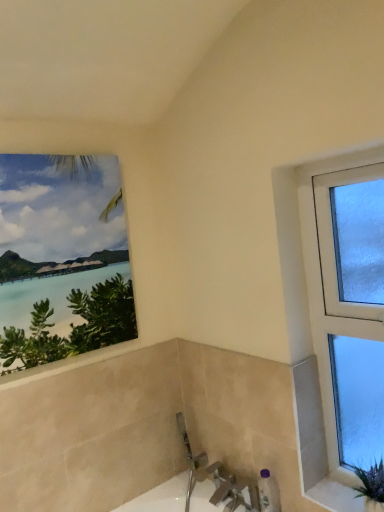
Question: In terms of height, does white textured stone at lower right look taller or shorter compared to purple plastic bottle at lower right?

Choices:
 (A) tall
 (B) short

Answer: (B)

Question: In the image, is white textured stone at lower right on the left side or the right side of purple plastic bottle at lower right?

Choices:
 (A) left
 (B) right

Answer: (B)

Question: Which object is the closest to the matte canvas painting at upper left, which appears as the 2th window when viewed from the right?

Choices:
 (A) purple plastic bottle at lower right
 (B) white glossy bath at lower center
 (C) white textured stone at lower right
 (D) clear glass window at right, which appears as the first window when viewed from the right

Answer: (D)

Question: Which of these objects is positioned farthest from the white textured stone at lower right?

Choices:
 (A) white glossy bath at lower center
 (B) purple plastic bottle at lower right
 (C) matte canvas painting at upper left, which appears as the 2th window when viewed from the right
 (D) clear glass window at right, which appears as the first window when viewed from the right

Answer: (C)